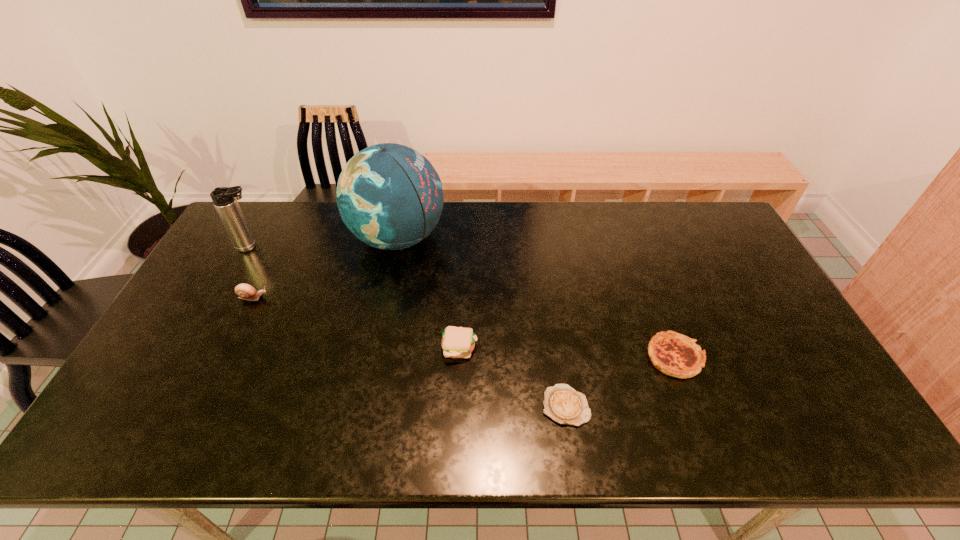
The width and height of the screenshot is (960, 540). What are the coordinates of `vacant space in between the third object from right to left and the second object from right to left` in the screenshot? It's located at (513, 377).

You are a GUI agent. You are given a task and a screenshot of the screen. Output one action in this format:
    pyautogui.click(x=<x>, y=<y>)
    Task: Click on the empty space that is in between the tallest object and the patty
    
    Given the screenshot: What is the action you would take?
    pyautogui.click(x=429, y=293)

Find the location of a particular element. The height and width of the screenshot is (540, 960). empty location between the right quiche and the fourth object from left to right is located at coordinates [567, 352].

Locate an element on the screen. The image size is (960, 540). free spot between the second object from right to left and the patty is located at coordinates (513, 377).

Where is `vacant region between the patty and the globe`? The width and height of the screenshot is (960, 540). vacant region between the patty and the globe is located at coordinates (429, 293).

What are the coordinates of `free spot between the patty and the globe` in the screenshot? It's located at (429, 293).

Locate an element on the screen. Image resolution: width=960 pixels, height=540 pixels. vacant region between the thermos bottle and the patty is located at coordinates (355, 297).

The height and width of the screenshot is (540, 960). Identify the location of object identified as the fifth closest to the second shortest object. (224, 199).

The image size is (960, 540). I want to click on object that is the fourth nearest to the globe, so click(563, 404).

Where is `free space in the image that satisfies the following two spatial constraints: 1. on the front-facing side of the second shortest object; 2. on the left side of the fourth nearest object`? This screenshot has height=540, width=960. free space in the image that satisfies the following two spatial constraints: 1. on the front-facing side of the second shortest object; 2. on the left side of the fourth nearest object is located at coordinates (225, 357).